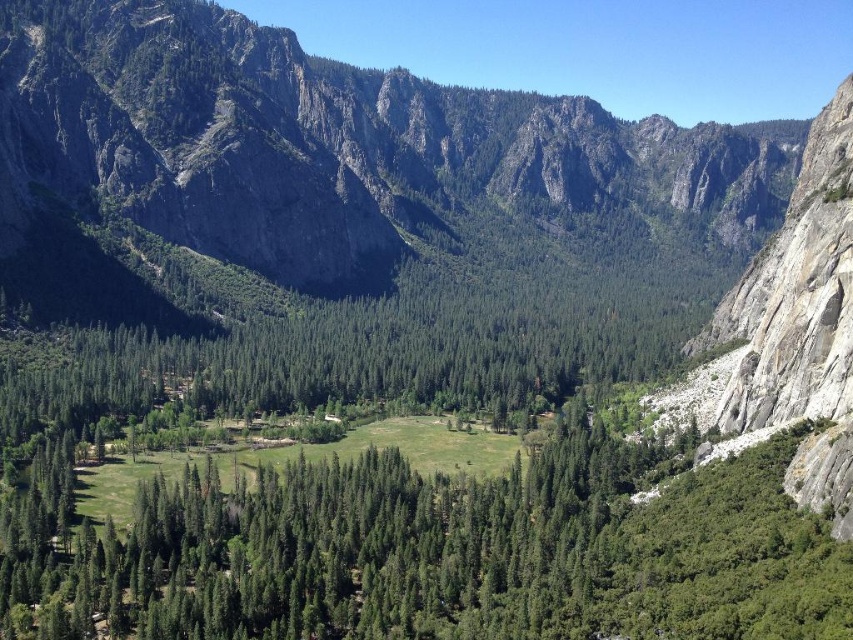
Question: Does dark gray rocky mountain at center appear on the right side of green leafy trees at center?

Choices:
 (A) yes
 (B) no

Answer: (A)

Question: From the image, what is the correct spatial relationship of dark gray rocky mountain at center in relation to green leafy trees at center?

Choices:
 (A) left
 (B) right

Answer: (B)

Question: Which point appears closest to the camera in this image?

Choices:
 (A) (314, 522)
 (B) (468, 237)

Answer: (A)

Question: In this image, where is dark gray rocky mountain at center located relative to green leafy trees at center?

Choices:
 (A) above
 (B) below

Answer: (A)